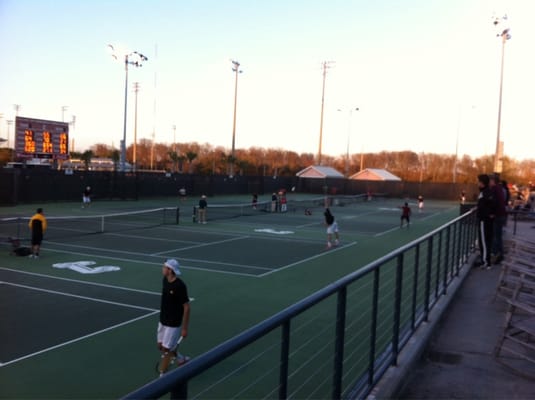
The image size is (535, 400). Find the location of `chairs`. chairs is located at coordinates tap(518, 328), tap(508, 279), tap(513, 260), tap(519, 246).